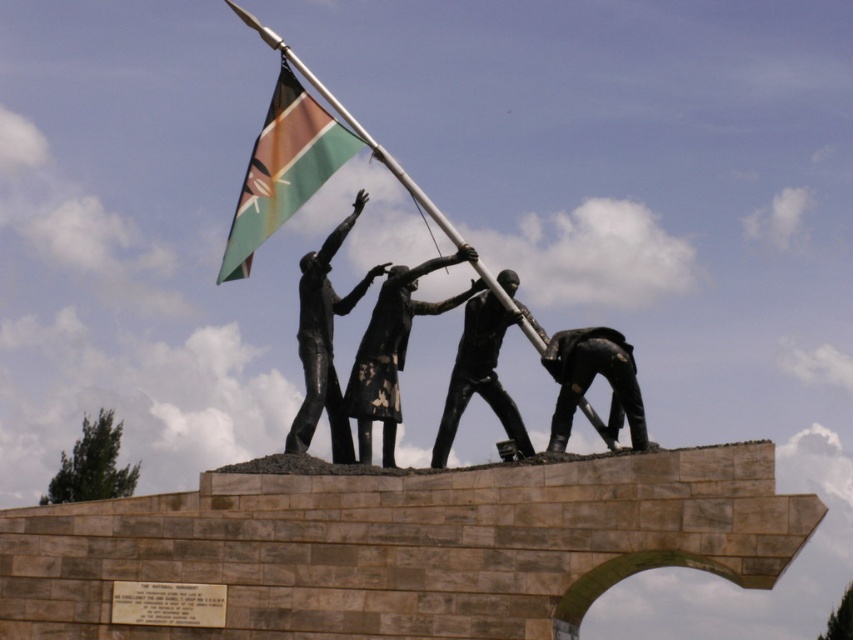
Question: Is green and brown painted flag at center smaller than bronze statue figure at center?

Choices:
 (A) yes
 (B) no

Answer: (B)

Question: Based on their relative distances, which object is farther from the green and brown painted flag at center?

Choices:
 (A) black polished statue at center
 (B) bronze statue at lower right
 (C) bronze statue figure at center

Answer: (B)

Question: Which of the following is the farthest from the observer?

Choices:
 (A) black polished statue at center
 (B) green and brown painted flag at center

Answer: (B)

Question: Which object is closer to the camera taking this photo?

Choices:
 (A) green and brown painted flag at center
 (B) bronze statue at lower right
 (C) black matte statue at center
 (D) black polished statue at center

Answer: (B)

Question: Considering the relative positions of black polished statue at center and bronze statue at lower right in the image provided, where is black polished statue at center located with respect to bronze statue at lower right?

Choices:
 (A) below
 (B) above

Answer: (B)

Question: Does green and brown painted flag at center have a lesser width compared to bronze statue at lower right?

Choices:
 (A) no
 (B) yes

Answer: (A)